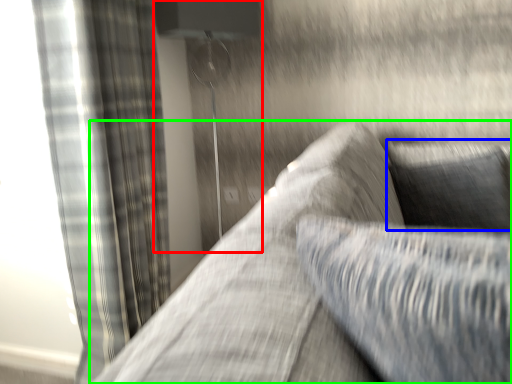
Question: Which object is positioned farthest from lamp (highlighted by a red box)? Select from pillow (highlighted by a blue box) and studio couch (highlighted by a green box).

Choices:
 (A) pillow
 (B) studio couch

Answer: (A)